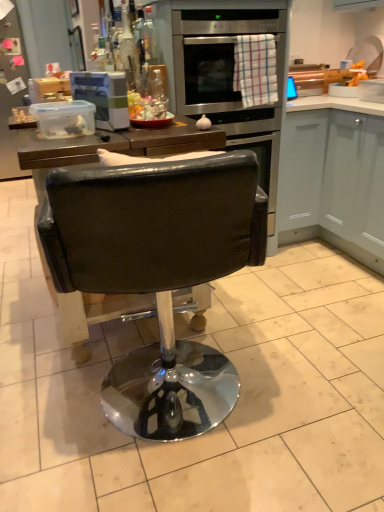
Question: Considering the relative sizes of white matte cabinet at right and black leather chair at center in the image provided, is white matte cabinet at right wider than black leather chair at center?

Choices:
 (A) no
 (B) yes

Answer: (A)

Question: From a real-world perspective, is white matte cabinet at right located higher than black leather chair at center?

Choices:
 (A) yes
 (B) no

Answer: (B)

Question: Would you say black leather chair at center is part of white matte cabinet at right's contents?

Choices:
 (A) no
 (B) yes

Answer: (A)

Question: From the image's perspective, is white matte cabinet at right over black leather chair at center?

Choices:
 (A) yes
 (B) no

Answer: (A)

Question: Can you confirm if white matte cabinet at right is shorter than black leather chair at center?

Choices:
 (A) yes
 (B) no

Answer: (A)

Question: Considering the relative sizes of white matte cabinet at right and black leather chair at center in the image provided, is white matte cabinet at right bigger than black leather chair at center?

Choices:
 (A) yes
 (B) no

Answer: (A)

Question: Considering the relative positions of black leather chair at center and white matte cabinet at right in the image provided, is black leather chair at center behind white matte cabinet at right?

Choices:
 (A) yes
 (B) no

Answer: (B)

Question: From a real-world perspective, is black leather chair at center on top of white matte cabinet at right?

Choices:
 (A) yes
 (B) no

Answer: (A)

Question: From the image's perspective, is black leather chair at center beneath white matte cabinet at right?

Choices:
 (A) yes
 (B) no

Answer: (A)

Question: Is black leather chair at center next to white matte cabinet at right?

Choices:
 (A) no
 (B) yes

Answer: (A)

Question: Can you confirm if black leather chair at center is wider than white matte cabinet at right?

Choices:
 (A) yes
 (B) no

Answer: (A)

Question: Is black leather chair at center positioned far away from white matte cabinet at right?

Choices:
 (A) no
 (B) yes

Answer: (B)

Question: From the image's perspective, is white matte cabinet at right above or below black leather chair at center?

Choices:
 (A) above
 (B) below

Answer: (A)